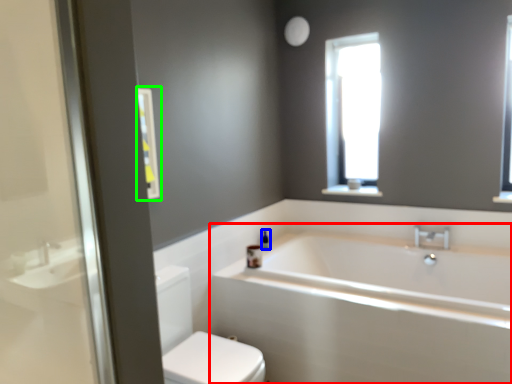
Question: Which object is positioned farthest from bathtub (highlighted by a red box)? Select from toiletry (highlighted by a blue box) and medicine cabinet (highlighted by a green box).

Choices:
 (A) toiletry
 (B) medicine cabinet

Answer: (B)